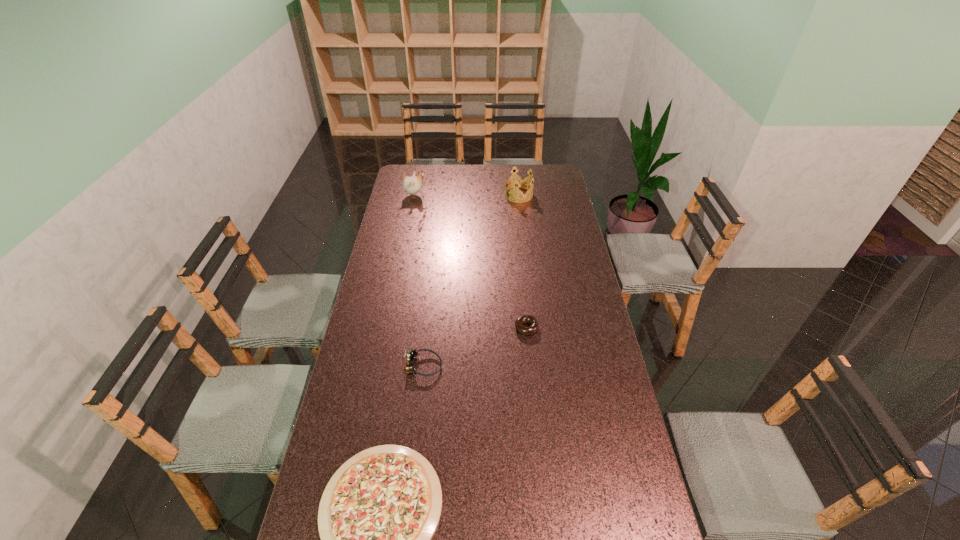
Where is `the tallest object`? the tallest object is located at coordinates (412, 185).

The image size is (960, 540). What are the coordinates of `crown` in the screenshot? It's located at (519, 181).

I want to click on the third tallest object, so click(x=411, y=354).

Identify the location of goggles. pyautogui.click(x=411, y=354).

Where is `doughnut`? The image size is (960, 540). doughnut is located at coordinates (522, 319).

At what (x,y) coordinates should I click in order to perform the action: click on the second shortest object. Please return your answer as a coordinate pair (x, y). Looking at the image, I should click on (522, 319).

I want to click on vacant space located 0.150m at the beak of the bird, so click(456, 195).

Where is `vacant space located on the left of the crown`? vacant space located on the left of the crown is located at coordinates (478, 195).

Where is `free space located 0.150m through the lenses of the goggles`? free space located 0.150m through the lenses of the goggles is located at coordinates (486, 366).

Identify the location of free region located 0.060m on the right of the third farthest object. (554, 328).